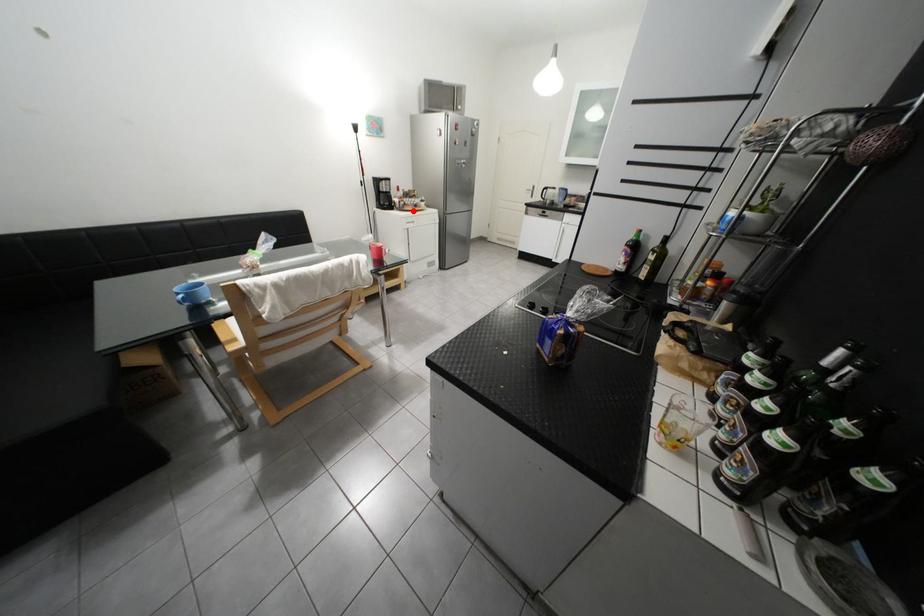
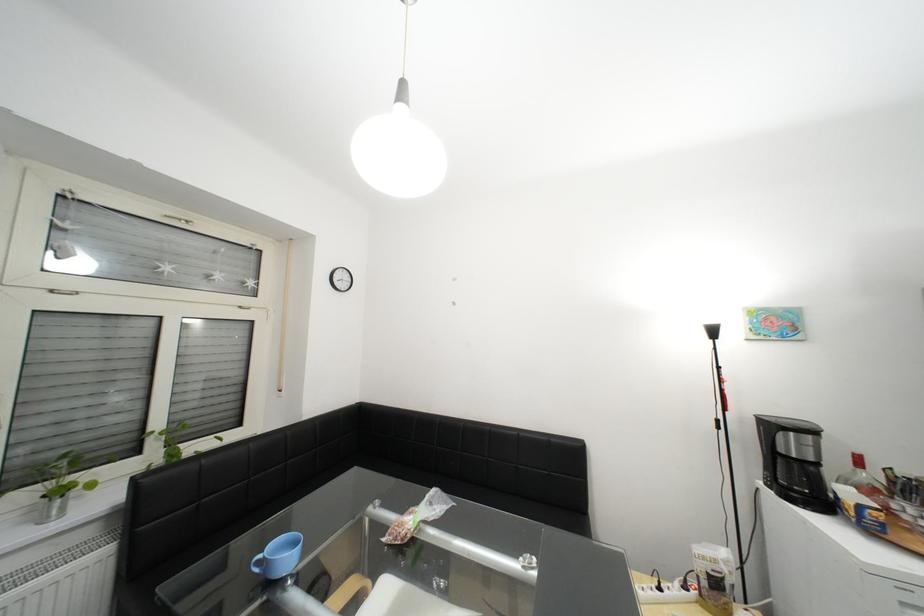
Find the pixel in the second image that matches the highlighted location in the first image.

(886, 533)